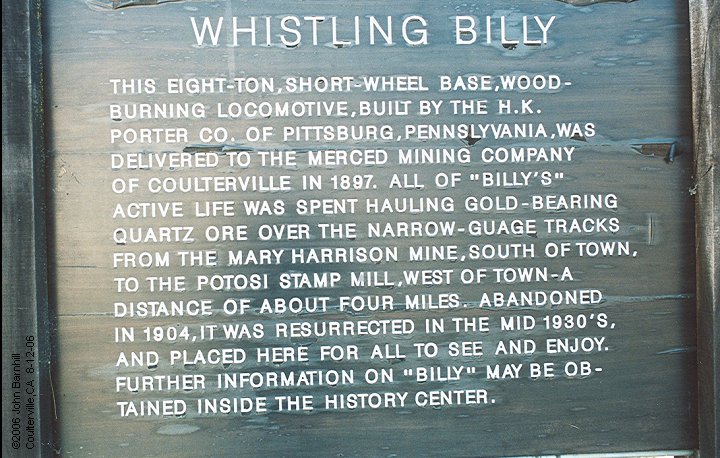
At what (x,y) coordinates should I click in order to perform the action: click on wooden plaque. Please return your answer as a coordinate pair (x, y). Looking at the image, I should click on (73, 48).